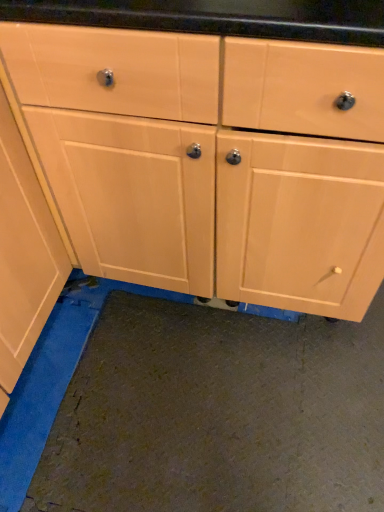
Locate an element on the screen. light wood cabinet at center is located at coordinates (209, 161).

Image resolution: width=384 pixels, height=512 pixels. What do you see at coordinates (209, 161) in the screenshot? I see `light wood cabinet at center` at bounding box center [209, 161].

You are a GUI agent. You are given a task and a screenshot of the screen. Output one action in this format:
    pyautogui.click(x=<x>, y=<y>)
    Task: Click on the light wood cabinet at center
    The image size is (384, 512).
    Given the screenshot: What is the action you would take?
    pyautogui.click(x=209, y=161)